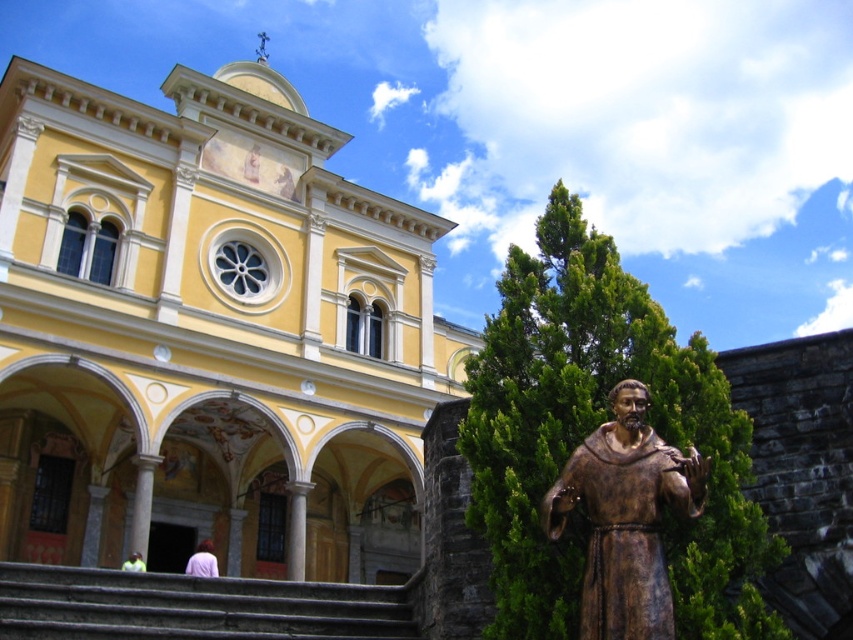
Is gray concrete stairs at lower left above bronze statue at right?

No, gray concrete stairs at lower left is not above bronze statue at right.

Does point (22, 616) come behind point (624, 481)?

Yes, point (22, 616) is farther from viewer.

Locate an element on the screen. Image resolution: width=853 pixels, height=640 pixels. gray concrete stairs at lower left is located at coordinates (192, 605).

Is point (596, 605) positioned after point (206, 557)?

No, it is in front of (206, 557).

Is bronze statue at right positioned behind light purple fabric at lower center?

That is False.

Measure the distance between bronze statue at right and camera.

bronze statue at right is 21.16 meters away from camera.

Identify the location of bronze statue at right. This screenshot has width=853, height=640. (625, 516).

Is point (103, 148) positioned in front of point (310, 588)?

No, it is behind (310, 588).

Is yellow painted stone church at upper left above gray concrete stairs at lower left?

Indeed, yellow painted stone church at upper left is positioned over gray concrete stairs at lower left.

Is point (149, 532) farther from camera compared to point (236, 624)?

Yes, point (149, 532) is farther from viewer.

At what (x,y) coordinates should I click in order to perform the action: click on yellow painted stone church at upper left. Please return your answer as a coordinate pair (x, y). This screenshot has width=853, height=640. Looking at the image, I should click on (209, 333).